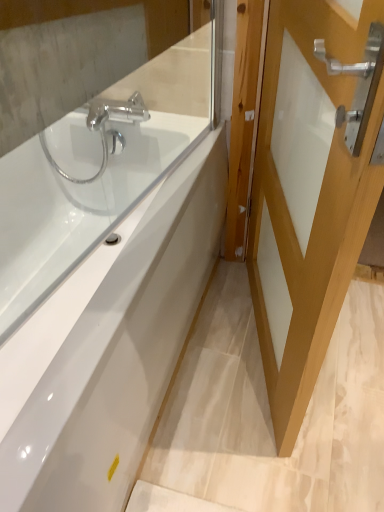
Question: Considering the relative sizes of clear glass mirror at upper left, arranged as the first mirror when viewed from the front, and white glossy bathtub at center in the image provided, is clear glass mirror at upper left, arranged as the first mirror when viewed from the front, wider than white glossy bathtub at center?

Choices:
 (A) yes
 (B) no

Answer: (B)

Question: Is clear glass mirror at upper left, arranged as the first mirror when viewed from the front, taller than white glossy bathtub at center?

Choices:
 (A) no
 (B) yes

Answer: (A)

Question: Is clear glass mirror at upper left, arranged as the first mirror when viewed from the front, outside of white glossy bathtub at center?

Choices:
 (A) yes
 (B) no

Answer: (A)

Question: Is white glossy bathtub at center at the back of clear glass mirror at upper left, arranged as the first mirror when viewed from the front?

Choices:
 (A) yes
 (B) no

Answer: (B)

Question: From the image's perspective, is clear glass mirror at upper left, arranged as the first mirror when viewed from the front, located beneath white glossy bathtub at center?

Choices:
 (A) no
 (B) yes

Answer: (A)

Question: Is clear glass mirror at upper left, which is the 2th mirror in back-to-front order, inside the boundaries of white glossy bathtub at center, or outside?

Choices:
 (A) inside
 (B) outside

Answer: (B)

Question: In terms of size, does clear glass mirror at upper left, arranged as the first mirror when viewed from the front, appear bigger or smaller than white glossy bathtub at center?

Choices:
 (A) small
 (B) big

Answer: (A)

Question: Is clear glass mirror at upper left, arranged as the first mirror when viewed from the front, taller or shorter than white glossy bathtub at center?

Choices:
 (A) tall
 (B) short

Answer: (B)

Question: From a real-world perspective, relative to white glossy bathtub at center, is clear glass mirror at upper left, which is the 2th mirror in back-to-front order, vertically above or below?

Choices:
 (A) above
 (B) below

Answer: (A)

Question: Looking at their shapes, would you say clear glass mirror at upper left, the 2th mirror positioned from the front, is wider or thinner than clear glass mirror at upper left, which is the 2th mirror in back-to-front order?

Choices:
 (A) thin
 (B) wide

Answer: (B)

Question: From a real-world perspective, relative to clear glass mirror at upper left, which is the 2th mirror in back-to-front order, is clear glass mirror at upper left, acting as the first mirror starting from the back, vertically above or below?

Choices:
 (A) above
 (B) below

Answer: (B)

Question: Based on their sizes in the image, would you say clear glass mirror at upper left, the 2th mirror positioned from the front, is bigger or smaller than clear glass mirror at upper left, which is the 2th mirror in back-to-front order?

Choices:
 (A) small
 (B) big

Answer: (B)

Question: Based on their positions, is clear glass mirror at upper left, acting as the first mirror starting from the back, located to the left or right of clear glass mirror at upper left, which is the 2th mirror in back-to-front order?

Choices:
 (A) left
 (B) right

Answer: (A)

Question: From the image's perspective, is white glossy door at right above or below clear glass mirror at upper left, the 2th mirror positioned from the front?

Choices:
 (A) above
 (B) below

Answer: (B)

Question: Is white glossy door at right situated inside clear glass mirror at upper left, the 2th mirror positioned from the front, or outside?

Choices:
 (A) inside
 (B) outside

Answer: (B)